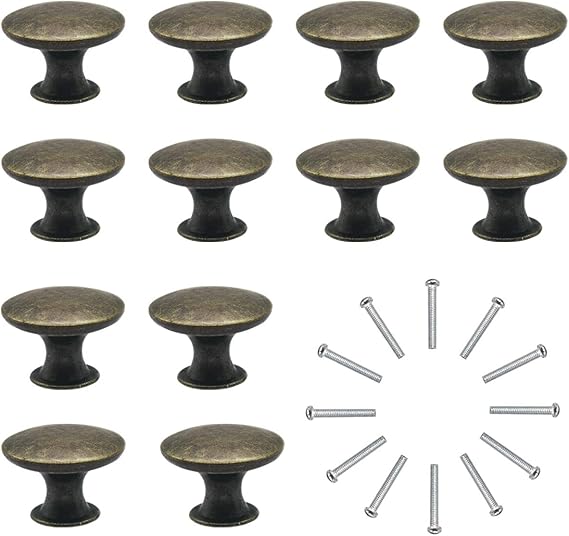
This screenshot has width=569, height=536. I want to click on two knobs in third row down, so click(x=226, y=337), click(x=68, y=347).